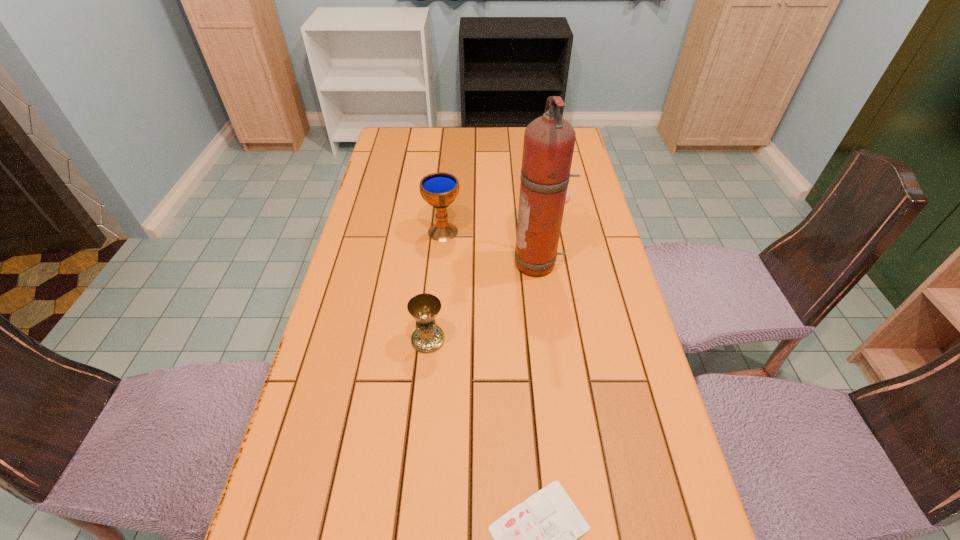
The height and width of the screenshot is (540, 960). In order to click on the tallest object in this screenshot , I will do `click(549, 140)`.

What are the coordinates of `the fourth shortest object` in the screenshot? It's located at tap(440, 189).

In order to click on the taller chalice in this screenshot , I will do `click(440, 189)`.

Where is `the nearer chalice`? The width and height of the screenshot is (960, 540). the nearer chalice is located at coordinates (428, 337).

Locate an element on the screen. This screenshot has width=960, height=540. the shorter chalice is located at coordinates (428, 337).

Locate an element on the screen. This screenshot has height=540, width=960. doughnut is located at coordinates (568, 193).

Image resolution: width=960 pixels, height=540 pixels. I want to click on the second shortest object, so click(x=568, y=193).

This screenshot has width=960, height=540. Find the location of `free region located 0.110m on the side of the tallest object with the label and nozzle`. free region located 0.110m on the side of the tallest object with the label and nozzle is located at coordinates (475, 264).

Locate an element on the screen. The height and width of the screenshot is (540, 960). vacant space located on the side of the tallest object with the label and nozzle is located at coordinates (457, 264).

Identify the location of free space located on the side of the tallest object with the label and nozzle. (422, 264).